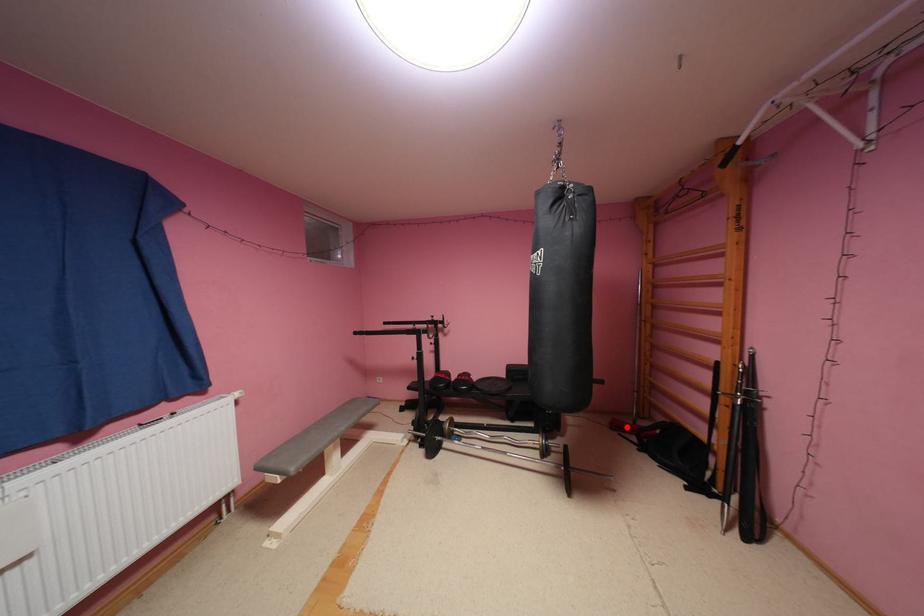
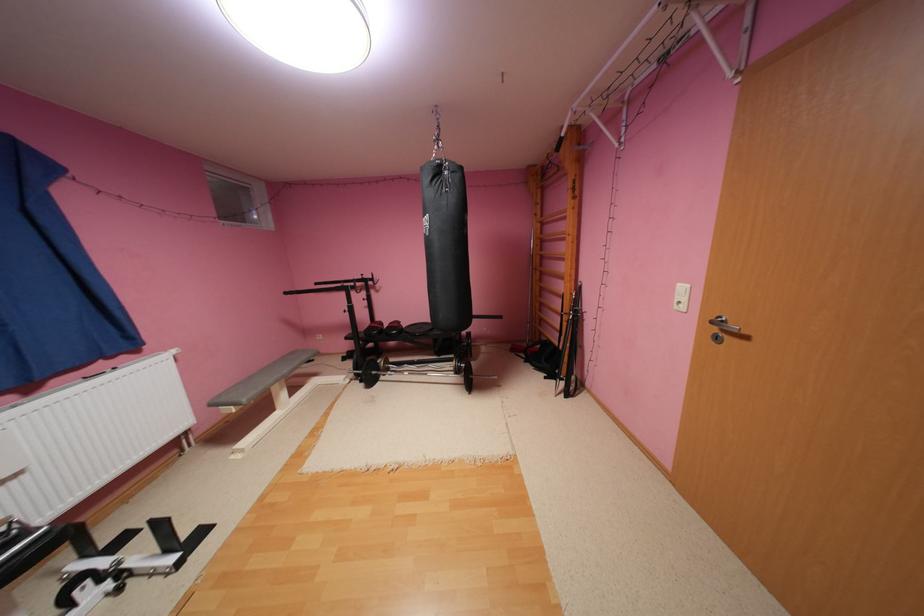
Question: I am providing you with two images of the same scene from different viewpoints. A red point is shown in image1. For the corresponding object point in image2, is it positioned nearer or farther from the camera?

Choices:
 (A) Nearer
 (B) Farther

Answer: (A)